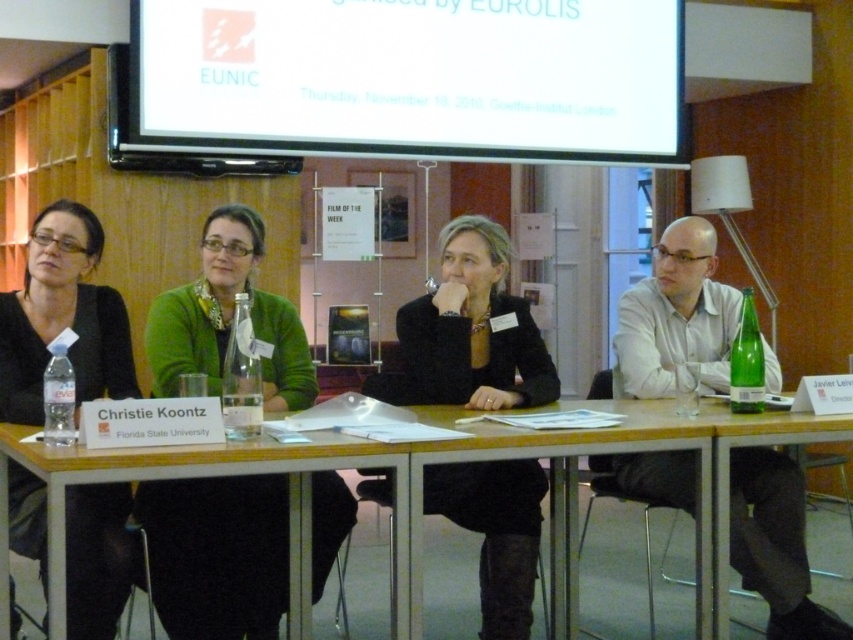
Question: Which object appears farthest from the camera in this image?

Choices:
 (A) white glossy projection screen at upper center
 (B) green glass bottle at right

Answer: (A)

Question: Does wooden table at center come in front of matte white shirt at right?

Choices:
 (A) no
 (B) yes

Answer: (B)

Question: Which of the following is the farthest from the observer?

Choices:
 (A) (64, 348)
 (B) (241, 364)
 (C) (467, 237)
 (D) (90, 593)

Answer: (C)

Question: In this image, where is green glass bottle at right located relative to clear plastic bottle at left?

Choices:
 (A) right
 (B) left

Answer: (A)

Question: Which point is closer to the camera?

Choices:
 (A) wooden table at center
 (B) clear glass bottle at center
 (C) clear plastic bottle at left

Answer: (A)

Question: Is wooden table at center positioned in front of green glass bottle at right?

Choices:
 (A) no
 (B) yes

Answer: (B)